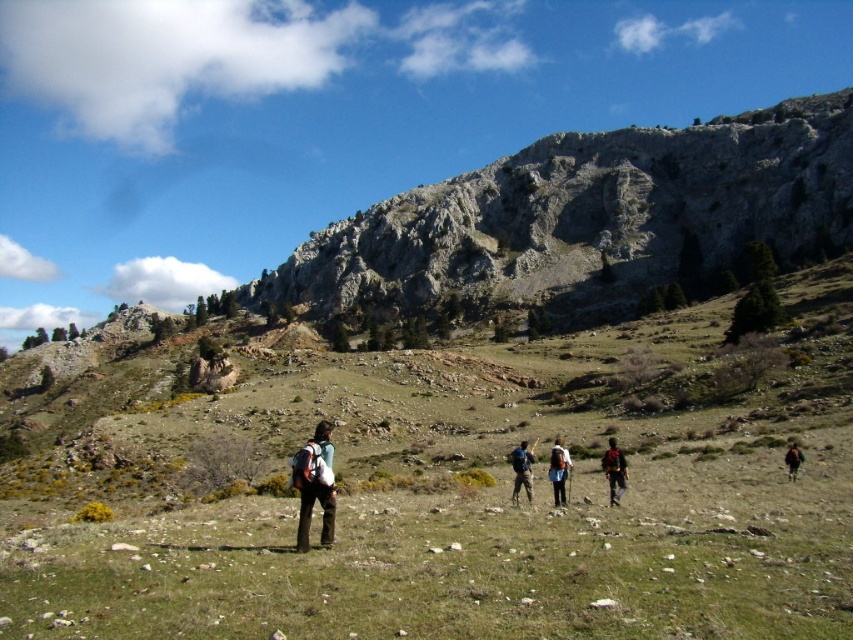
You are a hiker standing at the base of the rocky gray mountain at upper center and want to reach the matte black backpack at center. Which direction should you move to get closer to the backpack?

You should move away from the rocky gray mountain at upper center towards the matte black backpack at center because the mountain is closer to you than the backpack.

You are a hiker who wants to ensure your backpack is visible to your group. You have a matte black backpack at center and a matte blue backpack at center. Which backpack is more likely to be seen by others from behind?

The matte black backpack at center is in front of the matte blue backpack at center, so the matte blue backpack at center is more likely to be seen by others from behind because it is positioned behind the black one and thus more visible against the background.

In the scene shown: You are a hiker who needs to choose between two backpacks available at the center of the path. The matte black backpack at center and the matte blue backpack at center. Which backpack is taller?

The matte black backpack at center is taller than the matte blue backpack at center according to the description.